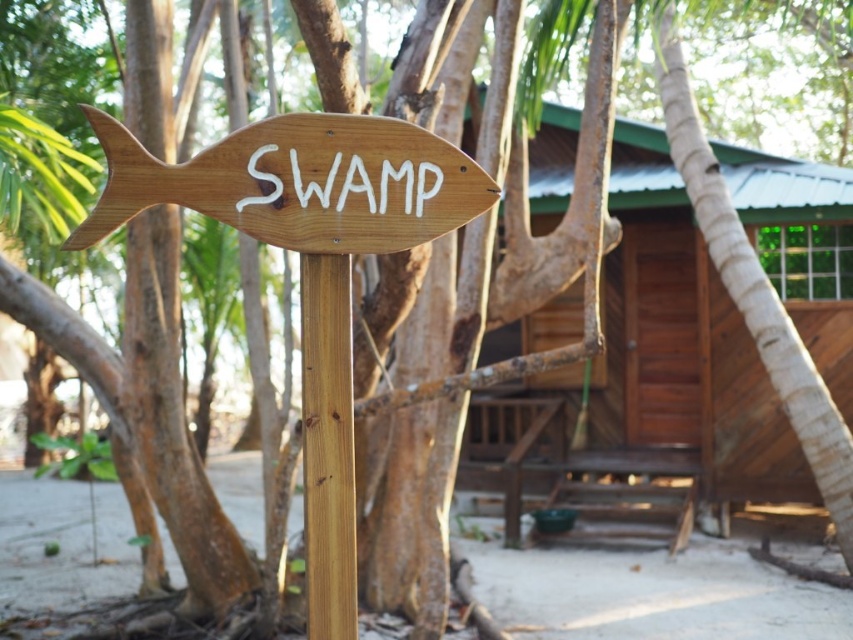
Does brown wooden hut at center have a larger size compared to light brown wood pole at center?

Yes, brown wooden hut at center is bigger than light brown wood pole at center.

Who is lower down, brown wooden hut at center or light brown wood pole at center?

Positioned lower is light brown wood pole at center.

Describe the element at coordinates (698, 369) in the screenshot. The width and height of the screenshot is (853, 640). I see `brown wooden hut at center` at that location.

Locate an element on the screen. This screenshot has width=853, height=640. brown wooden hut at center is located at coordinates (698, 369).

Who is taller, brown wooden hut at center or natural wood fish sign at left?

brown wooden hut at center

Between brown wooden hut at center and natural wood fish sign at left, which one has less height?

natural wood fish sign at left

Locate an element on the screen. Image resolution: width=853 pixels, height=640 pixels. brown wooden hut at center is located at coordinates (698, 369).

Which of these two, natural wood fish sign at left or light brown wood pole at center, stands shorter?

Standing shorter between the two is natural wood fish sign at left.

Does natural wood fish sign at left have a lesser height compared to light brown wood pole at center?

Indeed, natural wood fish sign at left has a lesser height compared to light brown wood pole at center.

Image resolution: width=853 pixels, height=640 pixels. What do you see at coordinates (300, 182) in the screenshot?
I see `natural wood fish sign at left` at bounding box center [300, 182].

Locate an element on the screen. The image size is (853, 640). natural wood fish sign at left is located at coordinates click(300, 182).